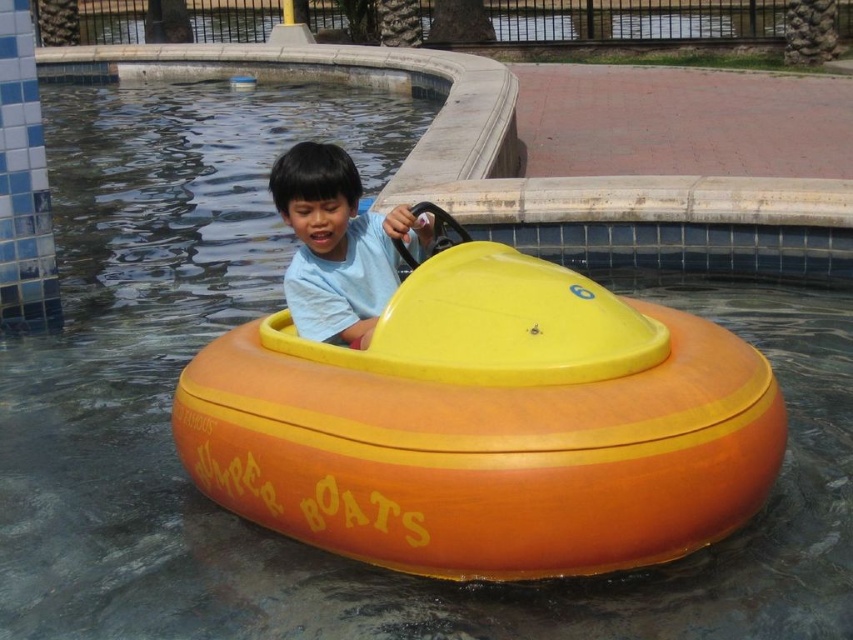
Question: Which point is closer to the camera?

Choices:
 (A) (483, 298)
 (B) (320, 202)

Answer: (A)

Question: Is orange matte bumper boat at center to the right of matte yellow bumper boat at center from the viewer's perspective?

Choices:
 (A) yes
 (B) no

Answer: (A)

Question: Does orange matte bumper boat at center lie behind matte yellow bumper boat at center?

Choices:
 (A) yes
 (B) no

Answer: (B)

Question: Which of the following is the closest to the observer?

Choices:
 (A) orange matte bumper boat at center
 (B) matte yellow bumper boat at center

Answer: (A)

Question: Does orange matte bumper boat at center appear on the left side of matte yellow bumper boat at center?

Choices:
 (A) no
 (B) yes

Answer: (A)